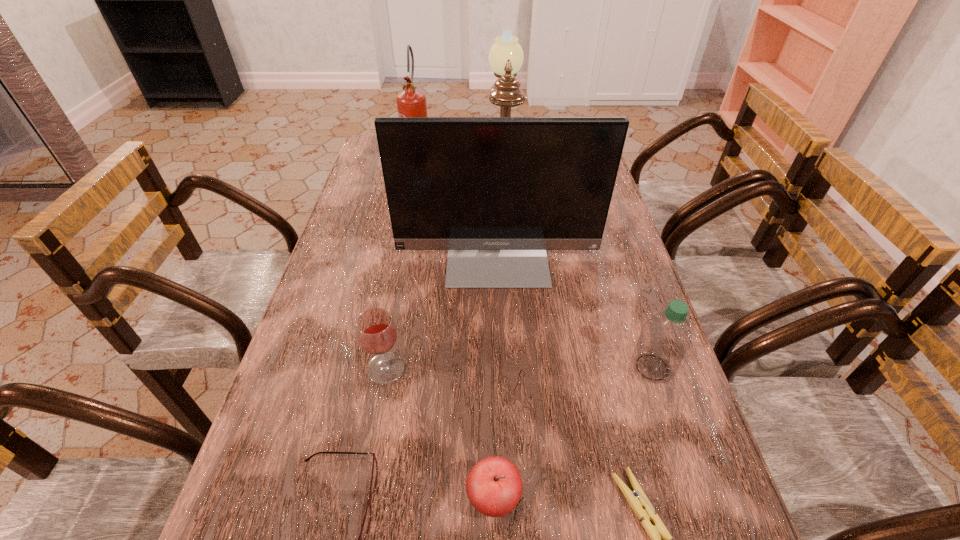
In order to click on oil lamp in this screenshot , I will do `click(506, 56)`.

Where is `fire extinguisher`? The image size is (960, 540). fire extinguisher is located at coordinates tap(411, 102).

This screenshot has width=960, height=540. I want to click on the sixth nearest object, so click(x=496, y=192).

At what (x,y) coordinates should I click in order to perform the action: click on the rightmost object. Please return your answer as a coordinate pair (x, y). The image size is (960, 540). Looking at the image, I should click on (665, 338).

Locate an element on the screen. Image resolution: width=960 pixels, height=540 pixels. the fourth tallest object is located at coordinates (665, 338).

Locate an element on the screen. wineglass is located at coordinates (376, 330).

The width and height of the screenshot is (960, 540). Find the location of `apple`. apple is located at coordinates (494, 486).

At what (x,y) coordinates should I click in order to perform the action: click on vacant space situated on the right of the oil lamp. Please return your answer as a coordinate pair (x, y). The height and width of the screenshot is (540, 960). Looking at the image, I should click on (596, 164).

Where is `free space located from the nozzle of the fire extinguisher`? This screenshot has height=540, width=960. free space located from the nozzle of the fire extinguisher is located at coordinates (402, 264).

Locate an element on the screen. vacant space situated 0.390m on the screen of the computer monitor is located at coordinates point(505,438).